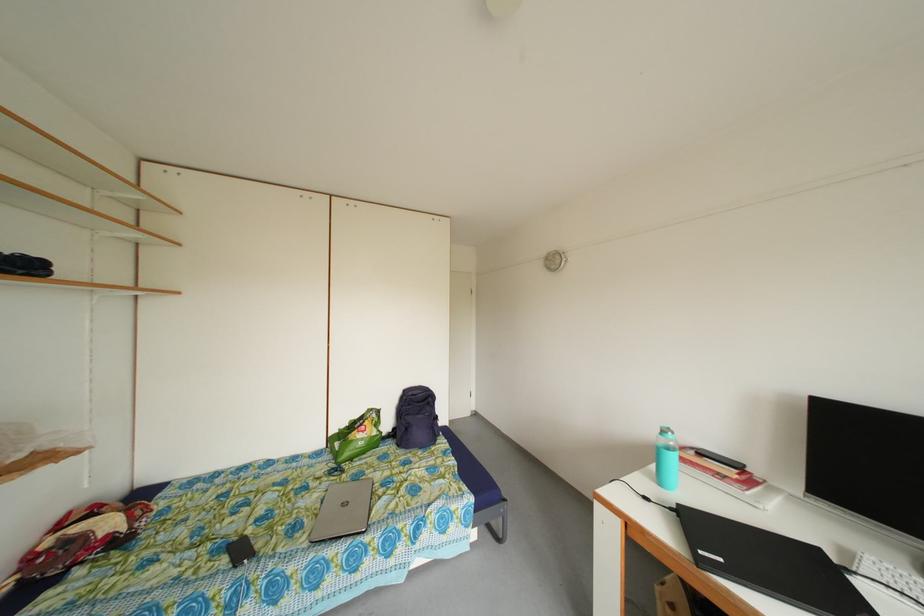
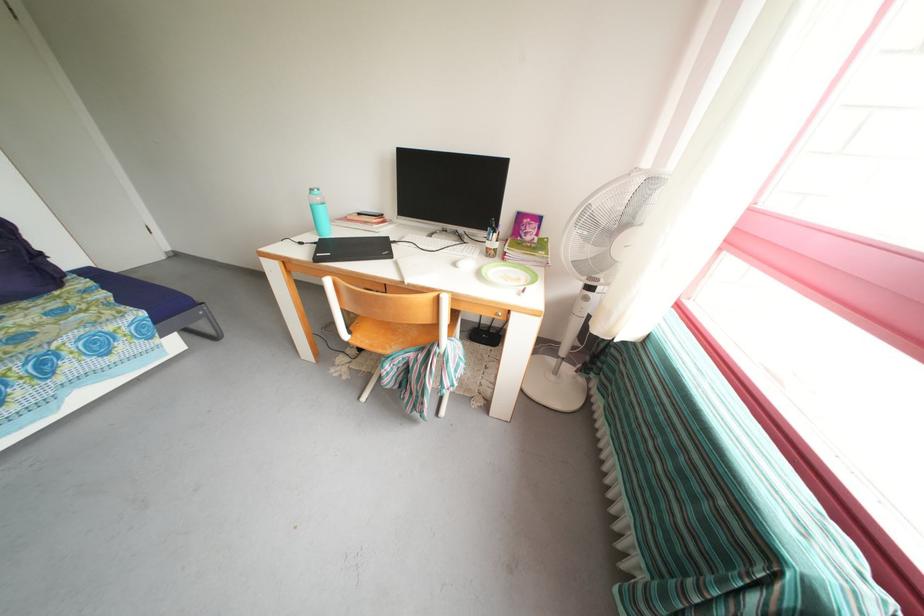
The point at (444,435) is marked in the first image. Where is the corresponding point in the second image?

(55, 276)